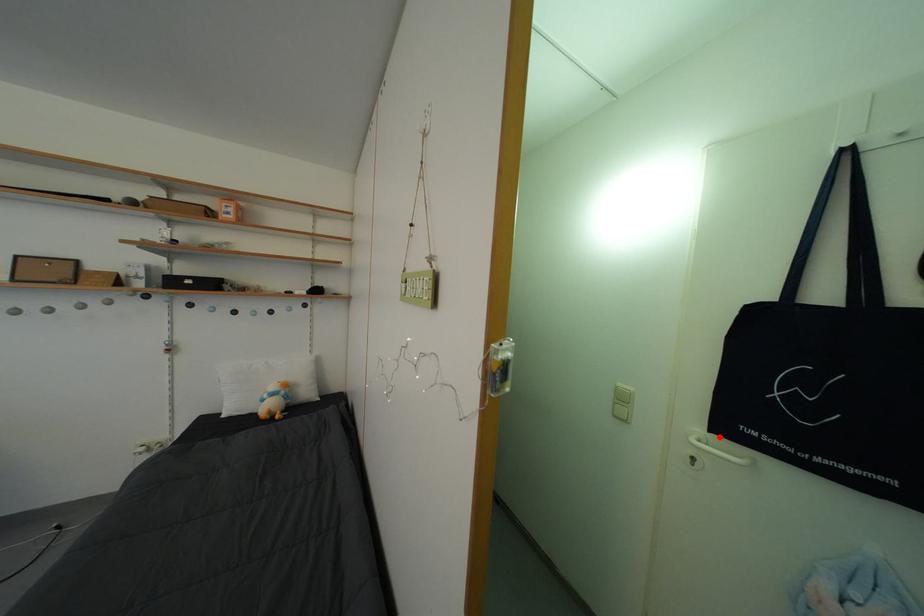
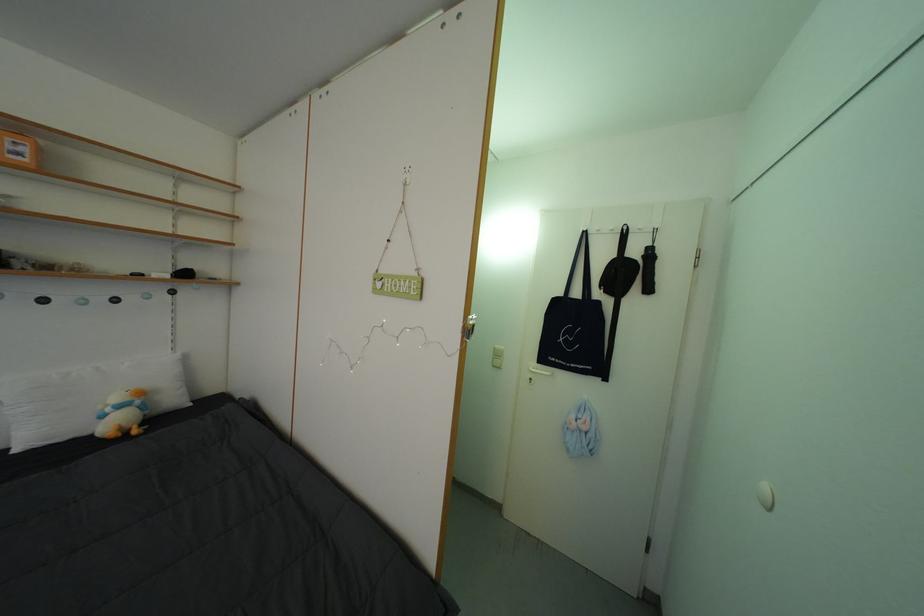
In the second image, find the point that corresponds to the highlighted location in the first image.

(546, 369)